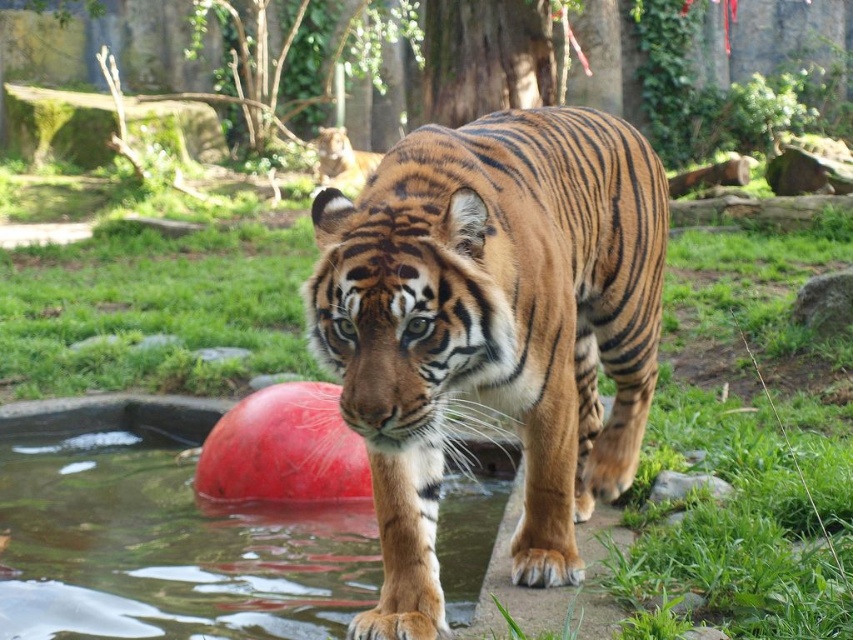
Is orange-brown striped tiger at center smaller than glossy plastic water at lower center?

No, orange-brown striped tiger at center is not smaller than glossy plastic water at lower center.

Does orange-brown striped tiger at center come behind glossy plastic water at lower center?

No, orange-brown striped tiger at center is closer to the viewer.

What do you see at coordinates (492, 326) in the screenshot? Image resolution: width=853 pixels, height=640 pixels. I see `orange-brown striped tiger at center` at bounding box center [492, 326].

At what (x,y) coordinates should I click in order to perform the action: click on orange-brown striped tiger at center. Please return your answer as a coordinate pair (x, y). This screenshot has height=640, width=853. Looking at the image, I should click on pos(492,326).